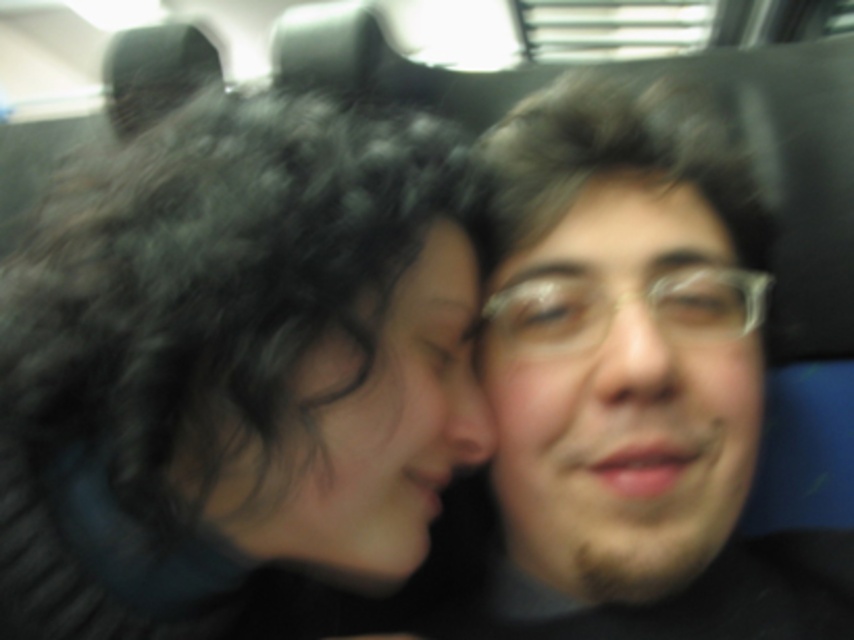
You are a photographer trying to capture a clear portrait of both the black curly hair at left and the smooth skin face at center in this moving vehicle. Considering their sizes in the frame, which subject should you focus on to ensure the smaller one is in sharp focus?

The smooth skin face at center is smaller than the black curly hair at left, so you should focus on the smooth skin face at center to ensure it remains in sharp focus.

In the scene shown: You are a photographer trying to adjust the lighting for a portrait. You notice two subjects in your frame, the black curly hair at left and the smooth skin face at center. Which subject should you focus the light on if you want to ensure the taller subject is properly illuminated?

The smooth skin face at center is taller than the black curly hair at left, so you should focus the light on the smooth skin face at center to ensure proper illumination.

You are taking a selfie inside a moving vehicle and want to ensure both subjects are centered. Given the coordinates of the black curly hair at left, can you determine if it is positioned to the left or right of the image center?

The position of black curly hair at left is at point (232, 364). Since the x coordinate is 0.570, which is greater than 0.5, it is positioned to the right of the image center.